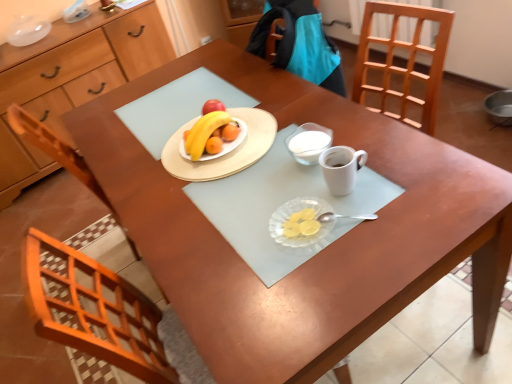
This screenshot has height=384, width=512. I want to click on free space in front of white matte coffee cup at center, so click(373, 231).